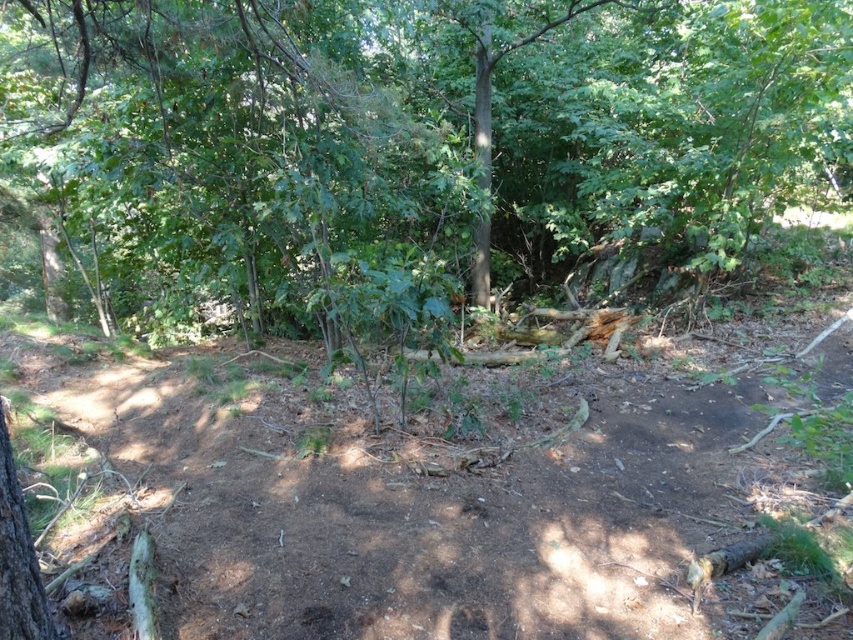
Looking at this image, you are a hiker trying to navigate through the forest. You see a green leafy tree at center and a brown dirt track at center. Which path should you follow to stay on the main trail?

The brown dirt track at center is the main trail, so you should follow it. The green leafy tree at center is smaller in size and likely not part of the trail.

In the scene shown: You are a hiker trying to follow the brown dirt track at center. There is a green leafy tree at center blocking your path. Which direction should you go to avoid the tree and stay on the track?

The green leafy tree at center is positioned on the left side of brown dirt track at center, so you should go to the right side of the tree to stay on the track.

You are navigating through the forest and need to determine the relative positions of two points marked on your map. The first point is at coordinate point (128,260) and the second is at point (686,406). Which point is farther away from you if you are facing north?

Point (128,260) is behind point (686,406), so if you are facing north, point (128,260) would be farther away from you since it is located behind the other point.